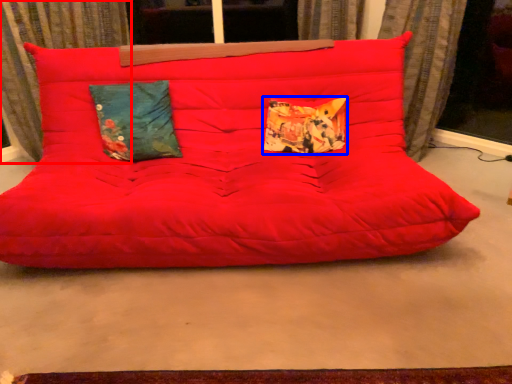
Question: Which object is closer to the camera taking this photo, curtain (highlighted by a red box) or pillow (highlighted by a blue box)?

Choices:
 (A) curtain
 (B) pillow

Answer: (A)